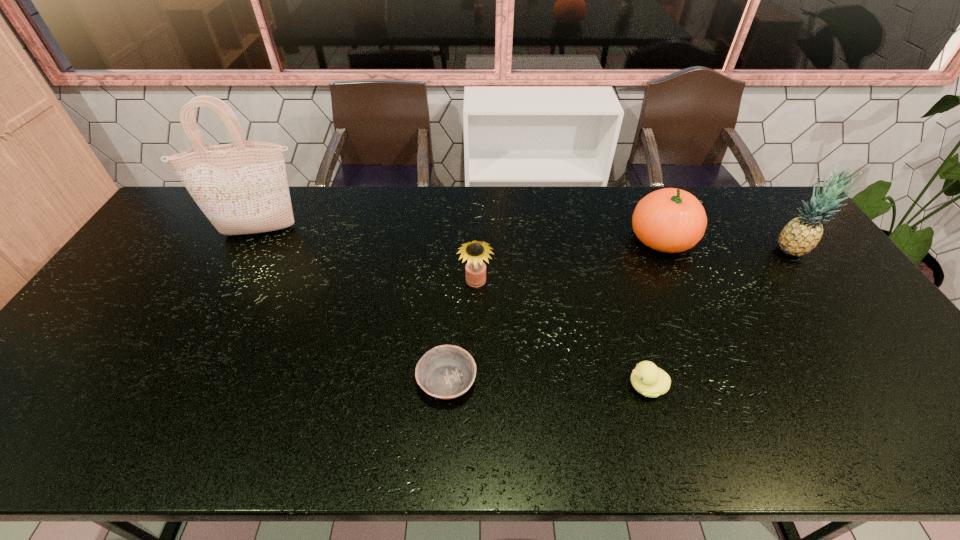
Image resolution: width=960 pixels, height=540 pixels. I want to click on shopping bag, so click(x=242, y=188).

I want to click on the leftmost object, so click(x=242, y=188).

Identify the location of pineapple. (801, 235).

At what (x,y) coordinates should I click in order to perform the action: click on the rightmost object. Please return your answer as a coordinate pair (x, y). The height and width of the screenshot is (540, 960). Looking at the image, I should click on (801, 235).

Image resolution: width=960 pixels, height=540 pixels. Find the location of `sunflower`. sunflower is located at coordinates (475, 251).

You are a GUI agent. You are given a task and a screenshot of the screen. Output one action in this format:
    pyautogui.click(x=<x>, y=<y>)
    Task: Click on the fifth object from left to right
    
    Given the screenshot: What is the action you would take?
    [x=671, y=220]

Identify the location of duckling. (647, 379).

Where is `the third object from right to left`? This screenshot has height=540, width=960. the third object from right to left is located at coordinates (647, 379).

What are the coordinates of `the shortest object` in the screenshot? It's located at (445, 372).

The height and width of the screenshot is (540, 960). In order to click on vacant space situated 0.110m on the back of the shopping bag in this screenshot , I will do `click(276, 202)`.